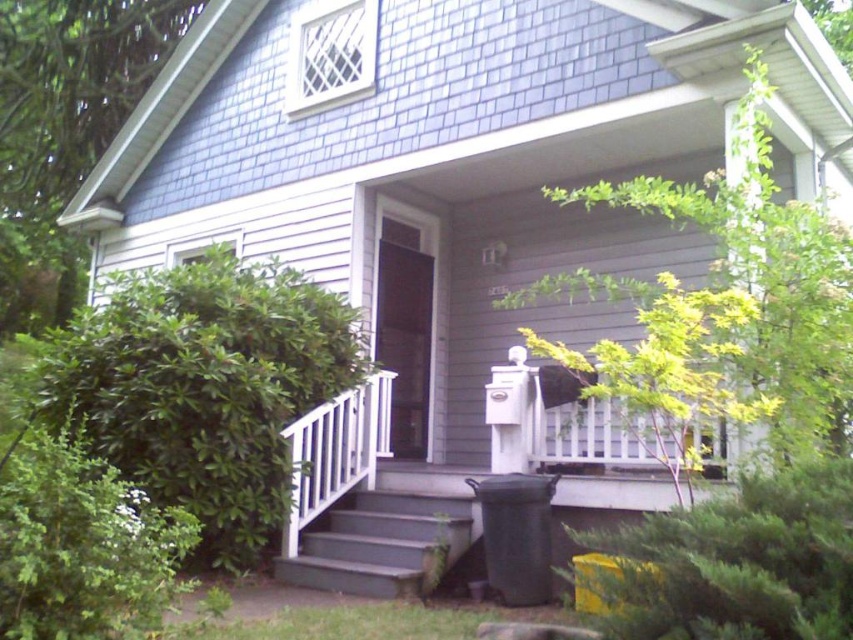
You are a gardener who needs to know which green leafy bush is wider. You see the green leafy bush at lower right and the green leafy bush at left in the front of the house. Which one is wider?

The green leafy bush at left is wider than the green leafy bush at lower right.

You are standing at the front of the house and want to place a new decorative item between the two points labeled as point (848, 548) and point (166, 584). Based on their positions, which point should the decorative item be closer to in order to maintain a balanced look?

The decorative item should be closer to point (166, 584) because point (848, 548) is in front of it, indicating it is closer to the viewer. Placing the item closer to the farther point would help balance the composition.